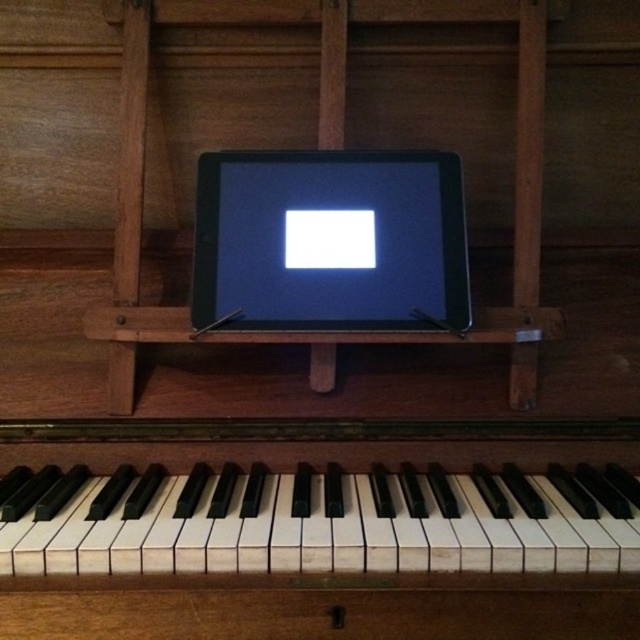
Between white matte piano keys at center and black glossy tablet at center, which one appears on the left side from the viewer's perspective?

From the viewer's perspective, white matte piano keys at center appears more on the left side.

Describe the element at coordinates (316, 536) in the screenshot. Image resolution: width=640 pixels, height=640 pixels. I see `white matte piano keys at center` at that location.

Between point (458, 493) and point (374, 202), which one is positioned in front?

Point (458, 493) is more forward.

You are a GUI agent. You are given a task and a screenshot of the screen. Output one action in this format:
    pyautogui.click(x=<x>, y=<y>)
    Task: Click on the white matte piano keys at center
    The height and width of the screenshot is (640, 640).
    Given the screenshot: What is the action you would take?
    pyautogui.click(x=316, y=536)